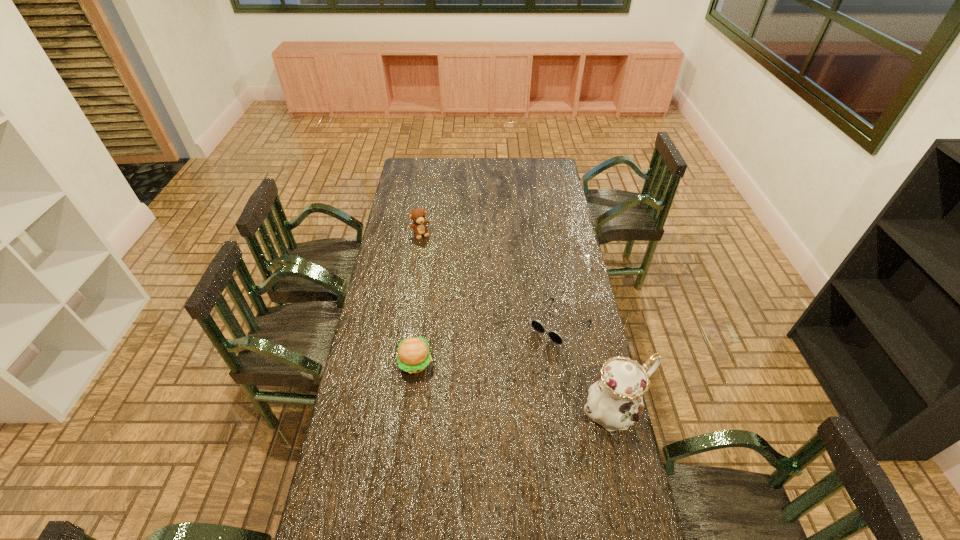
What are the coordinates of `vacant space situated on the front-facing side of the sunglasses` in the screenshot? It's located at (494, 392).

You are a GUI agent. You are given a task and a screenshot of the screen. Output one action in this format:
    pyautogui.click(x=<x>, y=<y>)
    Task: Click on the vacant region located 0.250m on the face of the second tallest object
    This screenshot has width=960, height=540.
    Given the screenshot: What is the action you would take?
    pyautogui.click(x=442, y=272)

This screenshot has width=960, height=540. What are the coordinates of `free space located 0.350m on the face of the second tallest object` in the screenshot? It's located at (449, 287).

Locate an element on the screen. This screenshot has width=960, height=540. free space located on the face of the second tallest object is located at coordinates (439, 266).

Identify the location of hamburger located in the left edge section of the desktop. (413, 356).

Where is `teddy bear positioned at the left edge`? teddy bear positioned at the left edge is located at coordinates (417, 215).

The width and height of the screenshot is (960, 540). I want to click on chinaware that is at the right edge, so click(615, 401).

Identify the location of sunglasses that is at the right edge. This screenshot has width=960, height=540. (536, 324).

In the image, there is a desktop. Where is `vacant space at the far edge`? vacant space at the far edge is located at coordinates (466, 161).

Where is `free space at the near edge of the desktop`? Image resolution: width=960 pixels, height=540 pixels. free space at the near edge of the desktop is located at coordinates (469, 514).